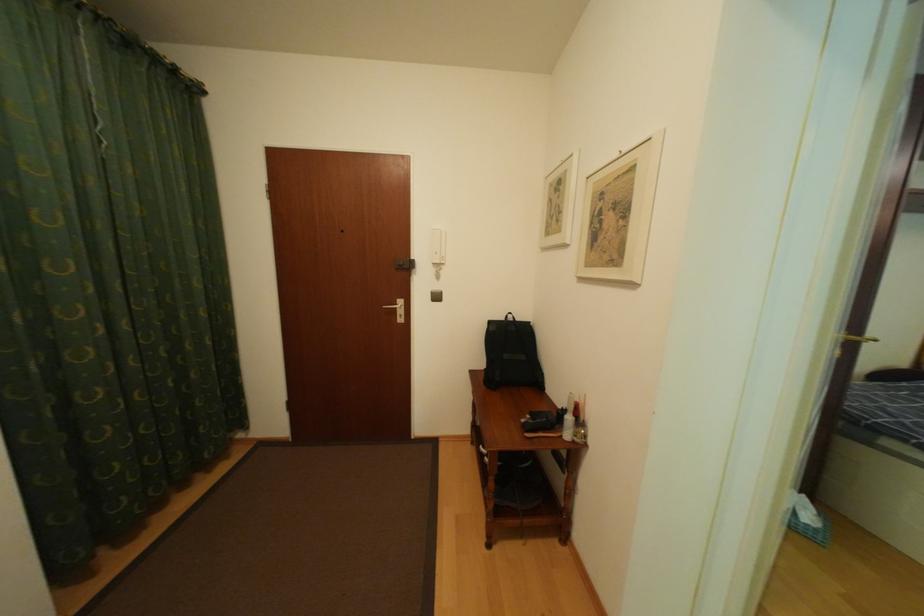
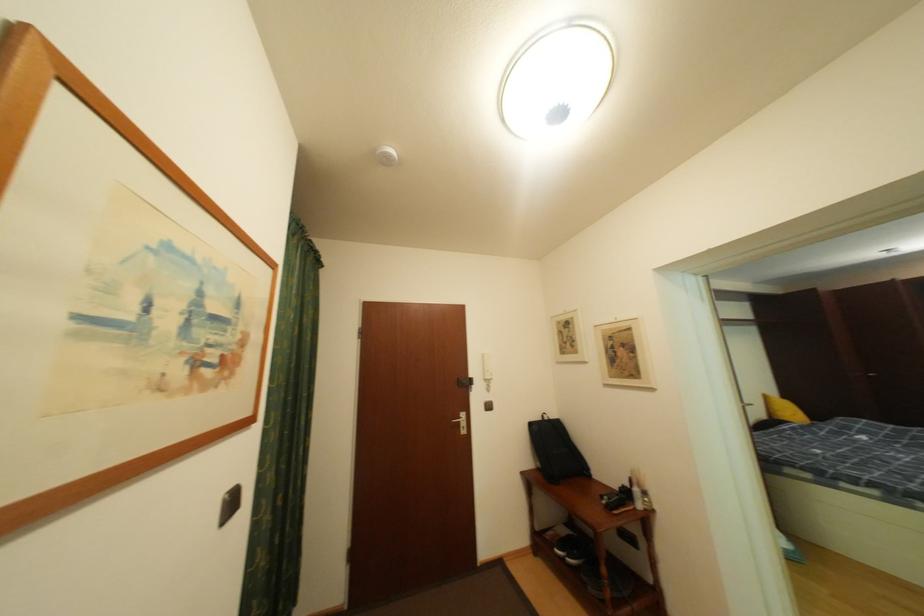
Looking at this image, in a continuous first-person perspective shot, in which direction is the camera moving?

The cameraman moved toward left, backward.